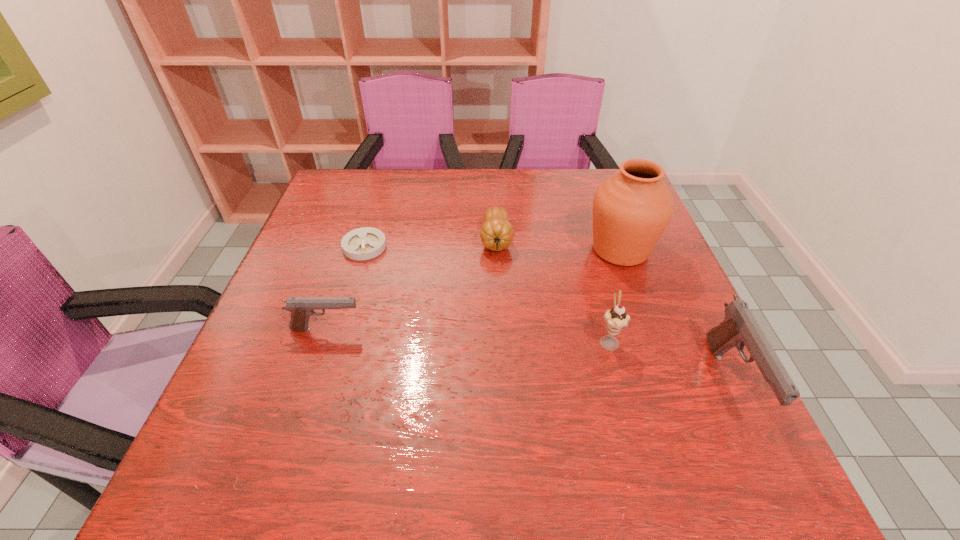
Please point a space for a new pistol to maintain equal intervals. Please provide its 2D coordinates. Your answer should be formatted as a tuple, i.e. [(x, y)], where the tuple contains the x and y coordinates of a point satisfying the conditions above.

[(517, 354)]